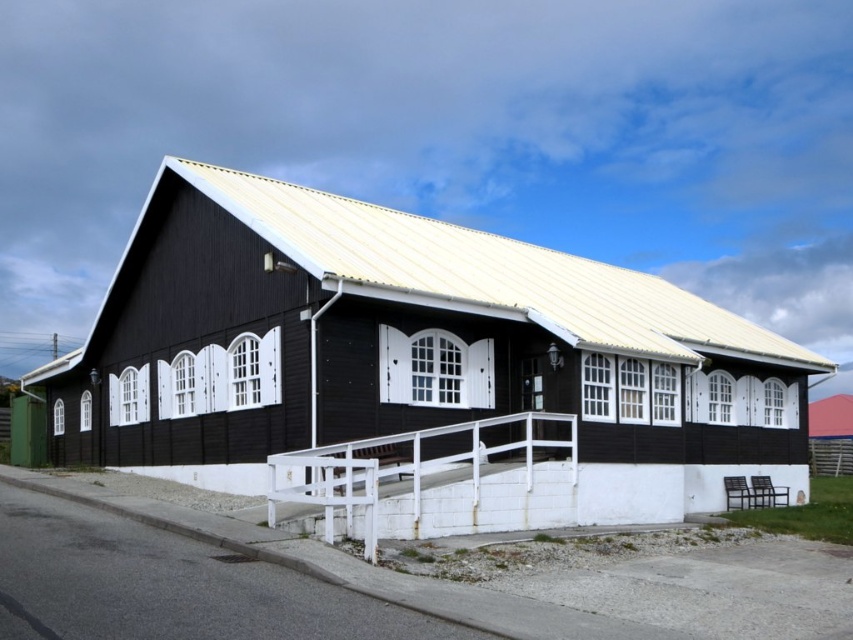
Between point (183, 333) and point (328, 470), which one is positioned behind?

The point (183, 333) is behind.

Is point (567, 260) positioned behind point (370, 508)?

Yes, it is behind point (370, 508).

Where is `black wood house at center`? The width and height of the screenshot is (853, 640). black wood house at center is located at coordinates (399, 342).